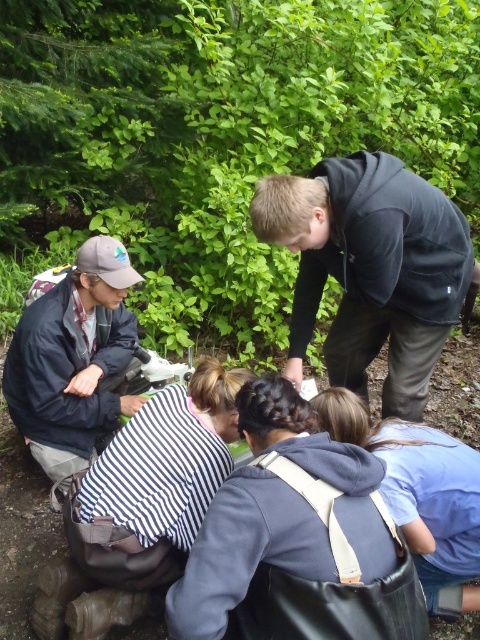
Can you confirm if dark gray hoodie at upper right is wider than blue fabric backpack at lower center?

Indeed, dark gray hoodie at upper right has a greater width compared to blue fabric backpack at lower center.

Who is shorter, dark gray hoodie at upper right or blue fabric backpack at lower center?

blue fabric backpack at lower center

Which is behind, point (433, 260) or point (417, 502)?

Point (433, 260)

The height and width of the screenshot is (640, 480). Find the location of `dark gray hoodie at upper right`. dark gray hoodie at upper right is located at coordinates (371, 269).

Who is taller, dark gray hoodie at center or white striped shirt at lower center?

Standing taller between the two is white striped shirt at lower center.

Who is more distant from viewer, (248, 624) or (178, 432)?

Positioned behind is point (178, 432).

Locate an element on the screen. dark gray hoodie at center is located at coordinates (280, 515).

Which is behind, point (379, 241) or point (269, 388)?

The point (379, 241) is behind.

Which of these two, dark gray hoodie at upper right or dark gray hoodie at center, stands taller?

With more height is dark gray hoodie at upper right.

Image resolution: width=480 pixels, height=640 pixels. Describe the element at coordinates (371, 269) in the screenshot. I see `dark gray hoodie at upper right` at that location.

What are the coordinates of `dark gray hoodie at upper right` in the screenshot? It's located at (371, 269).